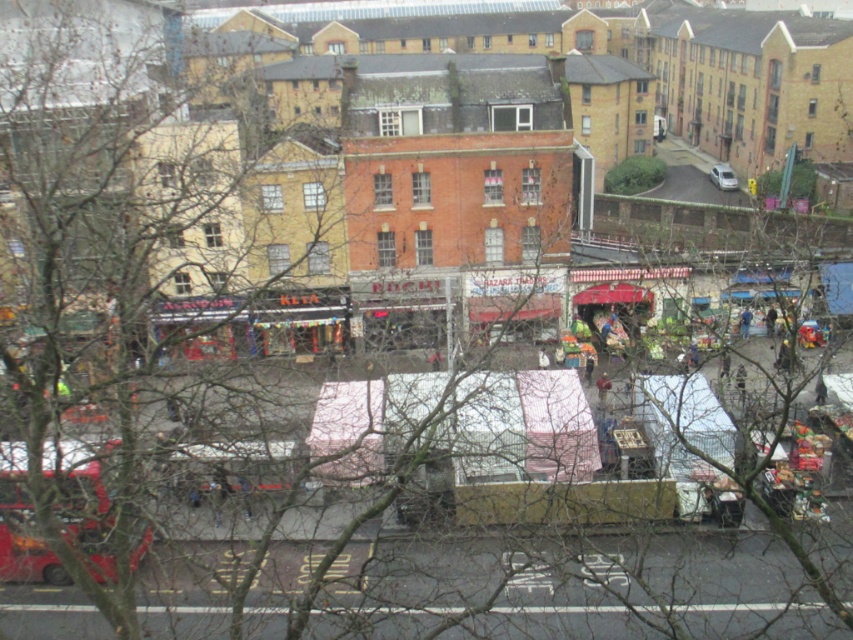
From the picture: You are a delivery person carrying a large box that is 1.2 meters wide. You need to pass through the space between the brown leather jacket at center and the blue fabric at center. Can your box fit through that space?

The brown leather jacket at center might be wider than blue fabric at center, so the space between them may not be wide enough for the 1.2 meter box. It is uncertain and risky to attempt passing through.